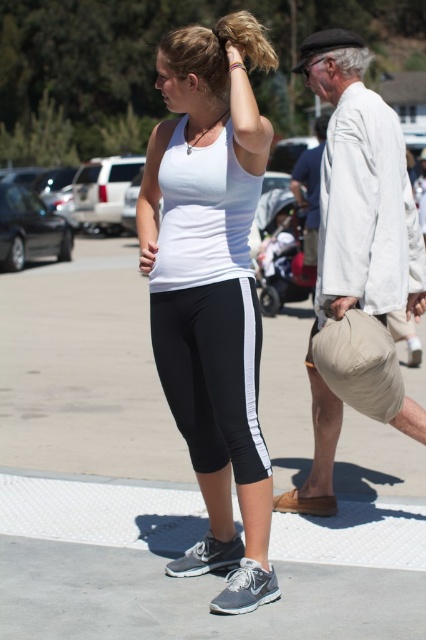
Question: Does khaki cotton shorts at right have a smaller size compared to black matte leggings at center?

Choices:
 (A) yes
 (B) no

Answer: (B)

Question: Which point is farther from the camera taking this photo?

Choices:
 (A) (270, 67)
 (B) (189, 429)
 (C) (293, 496)

Answer: (C)

Question: Considering the real-world distances, which object is farthest from the blonde hair at upper center?

Choices:
 (A) black matte leggings at center
 (B) white matte tank top at center
 (C) khaki cotton shorts at right

Answer: (A)

Question: Which object appears closest to the camera in this image?

Choices:
 (A) blonde hair at upper center
 (B) white matte tank top at center
 (C) khaki cotton shorts at right
 (D) black matte leggings at center

Answer: (B)

Question: Does white matte tank top at center appear on the left side of blonde hair at upper center?

Choices:
 (A) yes
 (B) no

Answer: (A)

Question: Is white matte tank top at center in front of khaki cotton shorts at right?

Choices:
 (A) yes
 (B) no

Answer: (A)